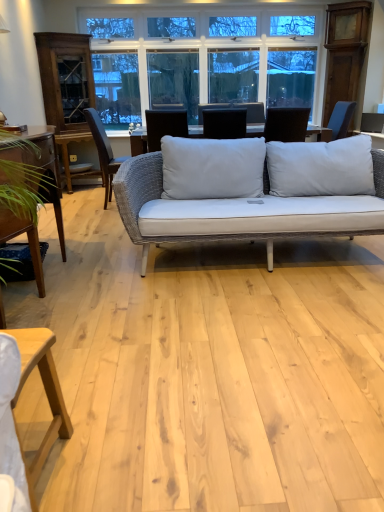
Where is `wooden table at left, acting as the 2th table starting from the bottom`? wooden table at left, acting as the 2th table starting from the bottom is located at coordinates (42, 169).

Is light wood table at lower left, which appears as the second table when viewed from the top, not close to white glass window at upper center?

Indeed, light wood table at lower left, which appears as the second table when viewed from the top, is not near white glass window at upper center.

Is light wood table at lower left, which is the 1th table in front-to-back order, in front of or behind white glass window at upper center in the image?

light wood table at lower left, which is the 1th table in front-to-back order, is in front of white glass window at upper center.

Is light wood table at lower left, acting as the second table starting from the left, looking in the opposite direction of white glass window at upper center?

No, white glass window at upper center is not at the back of light wood table at lower left, acting as the second table starting from the left.

Is matte black laptop at center, which appears as the 1th chair when viewed from the front, looking in the opposite direction of white glass window at upper center?

That's not correct — matte black laptop at center, which appears as the 1th chair when viewed from the front, is not looking away from white glass window at upper center.

Where is `window that is above the matte black laptop at center, which is counted as the first chair, starting from the right (from the image's perspective)`? window that is above the matte black laptop at center, which is counted as the first chair, starting from the right (from the image's perspective) is located at coordinates (215, 53).

Would you say matte black laptop at center, the 2th chair positioned from the left, is to the left or to the right of white glass window at upper center in the picture?

From the image, it's evident that matte black laptop at center, the 2th chair positioned from the left, is to the right of white glass window at upper center.

Is matte black laptop at center, which is counted as the first chair, starting from the right, inside wooden table at left, acting as the 2th table starting from the bottom?

No, matte black laptop at center, which is counted as the first chair, starting from the right, is not inside wooden table at left, acting as the 2th table starting from the bottom.

From the image's perspective, between wooden table at left, acting as the 1th table starting from the back, and matte black laptop at center, the 2th chair positioned from the left, who is located below?

From the image's view, wooden table at left, acting as the 1th table starting from the back, is below.

Is wooden table at left, the first table from the top, closer to the viewer compared to matte black laptop at center, which appears as the 1th chair when viewed from the front?

Yes, wooden table at left, the first table from the top, is closer to the camera.

The height and width of the screenshot is (512, 384). What are the coordinates of `the 1st table located beneath the matte black laptop at center, which is counted as the first chair, starting from the right (from a real-world perspective)` in the screenshot? It's located at (42, 169).

Considering the relative positions of light wood table at lower left, which is the 1th table in front-to-back order, and dark brown wood chair at left, arranged as the first chair when viewed from the back, in the image provided, is light wood table at lower left, which is the 1th table in front-to-back order, to the right of dark brown wood chair at left, arranged as the first chair when viewed from the back, from the viewer's perspective?

Correct, you'll find light wood table at lower left, which is the 1th table in front-to-back order, to the right of dark brown wood chair at left, arranged as the first chair when viewed from the back.

Is light wood table at lower left, acting as the second table starting from the left, positioned with its back to dark brown wood chair at left, which is the 1th chair in left-to-right order?

That's not correct — light wood table at lower left, acting as the second table starting from the left, is not looking away from dark brown wood chair at left, which is the 1th chair in left-to-right order.

Considering the relative sizes of light wood table at lower left, which appears as the second table when viewed from the top, and dark brown wood chair at left, which is the 1th chair in left-to-right order, in the image provided, is light wood table at lower left, which appears as the second table when viewed from the top, shorter than dark brown wood chair at left, which is the 1th chair in left-to-right order,?

Correct, light wood table at lower left, which appears as the second table when viewed from the top, is not as tall as dark brown wood chair at left, which is the 1th chair in left-to-right order.

Between white glass window at upper center and dark brown wood chair at left, arranged as the first chair when viewed from the back, which one has less height?

Standing shorter between the two is dark brown wood chair at left, arranged as the first chair when viewed from the back.

From a real-world perspective, is white glass window at upper center under dark brown wood chair at left, the second chair from the front?

Actually, white glass window at upper center is physically above dark brown wood chair at left, the second chair from the front, in the real world.

Between white glass window at upper center and dark brown wood chair at left, arranged as the first chair when viewed from the back, which one appears on the right side from the viewer's perspective?

Positioned to the right is white glass window at upper center.

Would you consider dark brown wood chair at left, which is the 1th chair in left-to-right order, to be distant from light wood table at lower left, positioned as the 1th table in right-to-left order?

Yes, dark brown wood chair at left, which is the 1th chair in left-to-right order, and light wood table at lower left, positioned as the 1th table in right-to-left order, are located far from each other.

Is dark brown wood chair at left, arranged as the first chair when viewed from the back, positioned behind light wood table at lower left, which appears as the second table when viewed from the top?

Yes, it is behind light wood table at lower left, which appears as the second table when viewed from the top.

Identify the location of the 2nd table in front of the dark brown wood chair at left, the second chair from the front. (46, 394).

Could you tell me if dark brown wood chair at left, the second chair from the front, is turned towards light wood table at lower left, positioned as the 1th table in right-to-left order?

No, dark brown wood chair at left, the second chair from the front, does not turn towards light wood table at lower left, positioned as the 1th table in right-to-left order.

Can you see dark brown wood chair at left, the second chair from the front, touching wooden table at left, which is the 1th table in left-to-right order?

No, dark brown wood chair at left, the second chair from the front, is not next to wooden table at left, which is the 1th table in left-to-right order.

Does dark brown wood chair at left, the second chair from the front, appear on the left side of wooden table at left, which is the 1th table in left-to-right order?

In fact, dark brown wood chair at left, the second chair from the front, is to the right of wooden table at left, which is the 1th table in left-to-right order.

From a real-world perspective, between dark brown wood chair at left, the second chair from the front, and wooden table at left, marked as the 2th table in a front-to-back arrangement, who is vertically lower?

In real-world perspective, wooden table at left, marked as the 2th table in a front-to-back arrangement, is lower.

In terms of width, does dark brown wood chair at left, arranged as the first chair when viewed from the back, look wider or thinner when compared to wooden table at left, placed as the 2th table when sorted from right to left?

In the image, dark brown wood chair at left, arranged as the first chair when viewed from the back, appears to be more narrow than wooden table at left, placed as the 2th table when sorted from right to left.

From the image's perspective, count 2nd tables downward from the white glass window at upper center and point to it. Please provide its 2D coordinates.

[(46, 394)]

Where is `window above the matte black laptop at center, the second chair viewed from the back (from the image's perspective)`? window above the matte black laptop at center, the second chair viewed from the back (from the image's perspective) is located at coordinates (215, 53).

Based on their spatial positions, is wooden table at left, marked as the 2th table in a front-to-back arrangement, or light wood table at lower left, which appears as the second table when viewed from the top, closer to matte black laptop at center, which is counted as the first chair, starting from the right?

wooden table at left, marked as the 2th table in a front-to-back arrangement.

Based on the photo, considering their positions, is wooden table at left, which is the 1th table in left-to-right order, positioned further to dark brown wood chair at left, arranged as the first chair when viewed from the back, than white glass window at upper center?

The object further to dark brown wood chair at left, arranged as the first chair when viewed from the back, is white glass window at upper center.

When comparing their distances from dark brown wood chair at left, the second chair from the front, does matte black laptop at center, which is counted as the first chair, starting from the right, or light wood table at lower left, which is the 1th table in front-to-back order, seem closer?

Among the two, matte black laptop at center, which is counted as the first chair, starting from the right, is located nearer to dark brown wood chair at left, the second chair from the front.

Which object lies further to the anchor point matte black laptop at center, which appears as the 1th chair when viewed from the front, white glass window at upper center or dark brown wood chair at left, arranged as the first chair when viewed from the back?

Based on the image, white glass window at upper center appears to be further to matte black laptop at center, which appears as the 1th chair when viewed from the front.

Estimate the real-world distances between objects in this image. Which object is further from wooden table at left, acting as the 2th table starting from the bottom, light wood table at lower left, positioned as the 1th table in right-to-left order, or matte black laptop at center, the second chair viewed from the back?

The object further to wooden table at left, acting as the 2th table starting from the bottom, is matte black laptop at center, the second chair viewed from the back.

Based on their spatial positions, is dark brown wood chair at left, placed as the second chair when sorted from right to left, or white glass window at upper center further from wooden table at left, the first table from the top?

white glass window at upper center.

Looking at the image, which one is located closer to white glass window at upper center, wooden table at left, placed as the 2th table when sorted from right to left, or light wood table at lower left, placed as the second table when sorted from back to front?

wooden table at left, placed as the 2th table when sorted from right to left, lies closer to white glass window at upper center than the other object.

From the picture: Considering their positions, is matte black laptop at center, which appears as the 1th chair when viewed from the front, positioned closer to white glass window at upper center than dark brown wood chair at left, arranged as the first chair when viewed from the back?

The object closer to white glass window at upper center is dark brown wood chair at left, arranged as the first chair when viewed from the back.

Where is `chair between light wood table at lower left, the first table ordered from the bottom, and dark brown wood chair at left, placed as the second chair when sorted from right to left, in the front-back direction`? This screenshot has width=384, height=512. chair between light wood table at lower left, the first table ordered from the bottom, and dark brown wood chair at left, placed as the second chair when sorted from right to left, in the front-back direction is located at coordinates (224, 123).

Locate an element on the screen. The image size is (384, 512). chair located between matte black laptop at center, the second chair viewed from the back, and white glass window at upper center in the depth direction is located at coordinates (103, 152).

This screenshot has height=512, width=384. Identify the location of table between light wood table at lower left, acting as the second table starting from the left, and matte black laptop at center, the 2th chair positioned from the left, in the front-back direction. (42, 169).

Identify the location of table between light wood table at lower left, which is the 1th table in front-to-back order, and white glass window at upper center in the front-back direction. This screenshot has width=384, height=512. (42, 169).